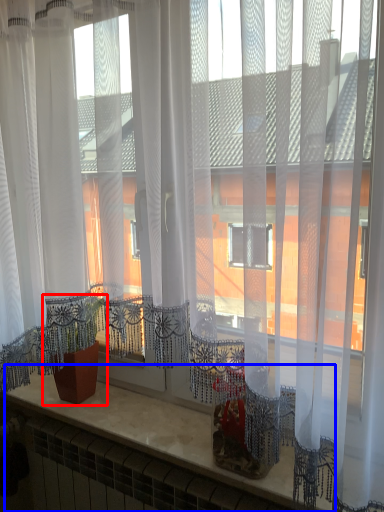
Question: Which of the following is the closest to the observer, houseplant (highlighted by a red box) or counter top (highlighted by a blue box)?

Choices:
 (A) houseplant
 (B) counter top

Answer: (B)